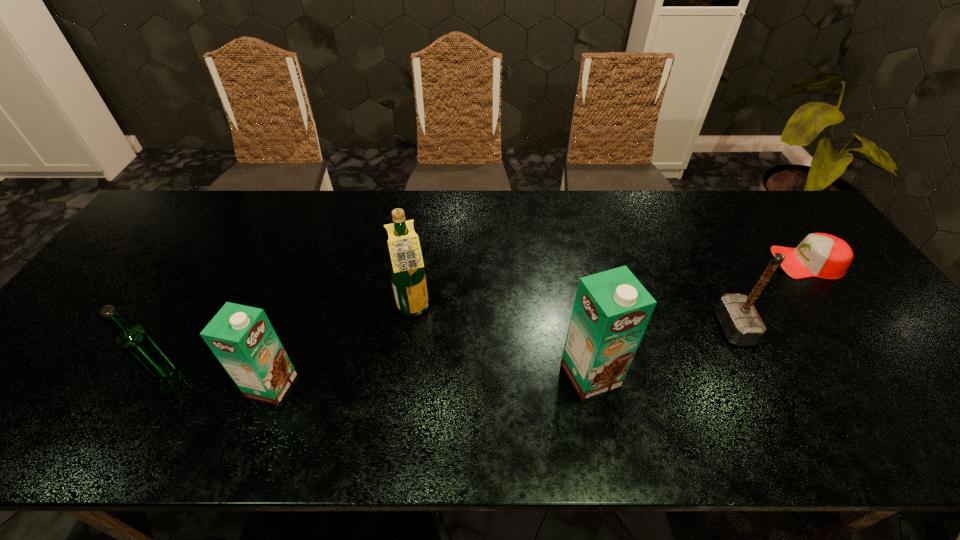
Identify the location of free space between the right carton and the leftmost object. (376, 373).

This screenshot has height=540, width=960. Find the location of `free space between the fourth object from right to left and the right carton`. free space between the fourth object from right to left and the right carton is located at coordinates (502, 342).

Identify the location of free space that is in between the fifth object from left to right and the leftmost object. (448, 350).

Find the location of a particular element. This screenshot has width=960, height=540. vacant space that's between the leftmost object and the second object from left to right is located at coordinates (218, 379).

I want to click on unoccupied position between the fourth object from right to left and the fourth object from left to right, so click(502, 342).

This screenshot has height=540, width=960. I want to click on free spot between the hammer and the shorter carton, so click(502, 357).

Find the location of `object that is the closest to the right carton`. object that is the closest to the right carton is located at coordinates (740, 321).

Identify which object is the third nearest to the shortest object. Please provide its 2D coordinates. Your answer should be formatted as a tuple, i.e. [(x, y)], where the tuple contains the x and y coordinates of a point satisfying the conditions above.

[(407, 271)]